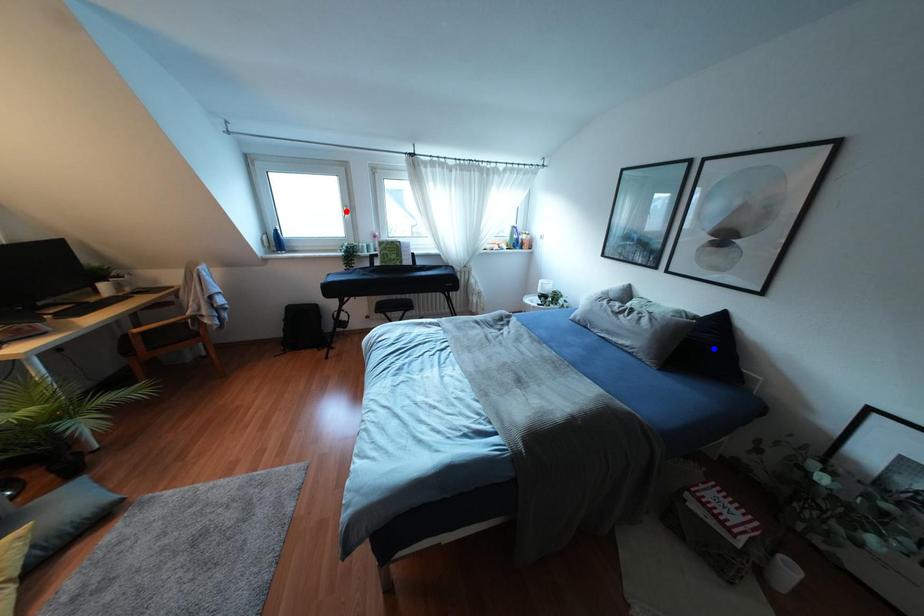
Question: Which of the two points in the image is closer to the camera?

Choices:
 (A) Blue point is closer.
 (B) Red point is closer.

Answer: (A)